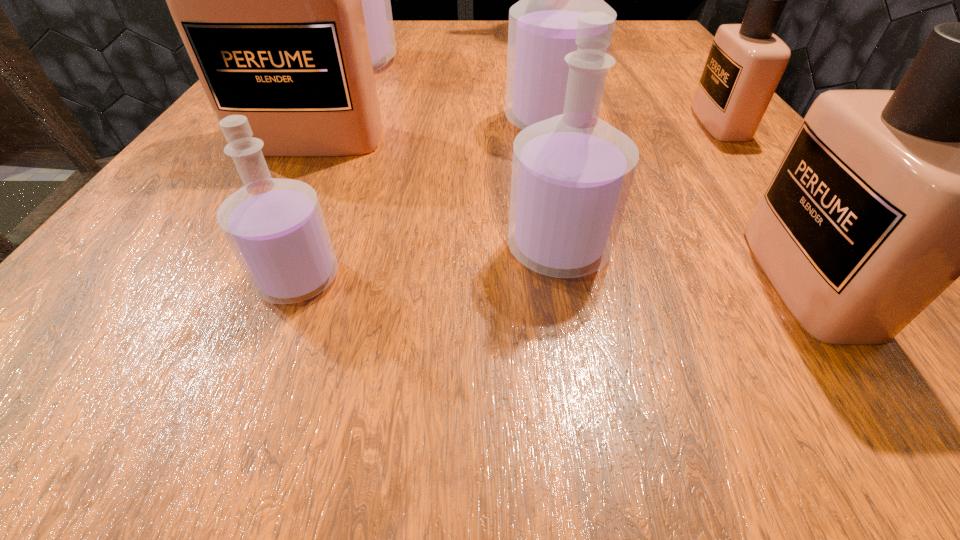
Locate an element on the screen. free space located 0.300m on the front label of the smallest beige perfume is located at coordinates (514, 122).

You are a GUI agent. You are given a task and a screenshot of the screen. Output one action in this format:
    pyautogui.click(x=<x>, y=<y>)
    Task: Click on the free location located on the back of the smallest purple perfume
    The width and height of the screenshot is (960, 540).
    Given the screenshot: What is the action you would take?
    pyautogui.click(x=345, y=160)

Where is `fire extinguisher that is at the far edge`? fire extinguisher that is at the far edge is located at coordinates (603, 0).

At what (x,y) coordinates should I click in order to perform the action: click on perfume situated at the far edge. Please return your answer as a coordinate pair (x, y). The height and width of the screenshot is (540, 960). Looking at the image, I should click on (376, 3).

The height and width of the screenshot is (540, 960). What are the coordinates of `object situated at the near edge` in the screenshot? It's located at (884, 198).

The width and height of the screenshot is (960, 540). What are the coordinates of `fire extinguisher that is at the right edge` in the screenshot? It's located at (603, 0).

Locate an element on the screen. The width and height of the screenshot is (960, 540). object positioned at the far left corner is located at coordinates (376, 3).

In order to click on object present at the far right corner in this screenshot , I will do `click(603, 0)`.

Identify the location of object that is at the near right corner. (884, 198).

Image resolution: width=960 pixels, height=540 pixels. I want to click on vacant area at the far edge of the desktop, so click(x=444, y=30).